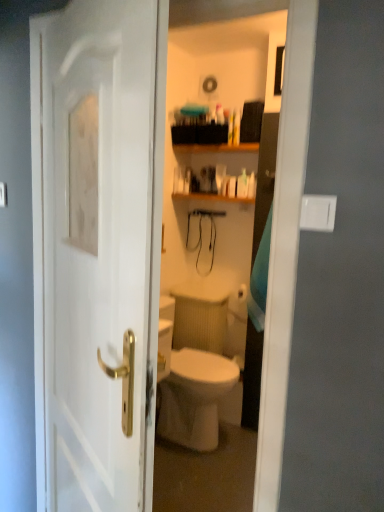
Question: From the image's perspective, does white glossy bottle at upper center appear higher than wooden shelf at upper center?

Choices:
 (A) no
 (B) yes

Answer: (A)

Question: Is white glossy bottle at upper center looking in the opposite direction of wooden shelf at upper center?

Choices:
 (A) yes
 (B) no

Answer: (B)

Question: Can you confirm if white glossy bottle at upper center is bigger than wooden shelf at upper center?

Choices:
 (A) no
 (B) yes

Answer: (A)

Question: Is the position of white glossy bottle at upper center less distant than that of wooden shelf at upper center?

Choices:
 (A) yes
 (B) no

Answer: (B)

Question: From the image's perspective, is white glossy bottle at upper center under wooden shelf at upper center?

Choices:
 (A) yes
 (B) no

Answer: (A)

Question: Is white glossy bottle at upper center wider or thinner than wooden shelf at upper center?

Choices:
 (A) wide
 (B) thin

Answer: (B)

Question: Which is correct: white glossy bottle at upper center is inside wooden shelf at upper center, or outside of it?

Choices:
 (A) outside
 (B) inside

Answer: (A)

Question: From a real-world perspective, is white glossy bottle at upper center physically located above or below wooden shelf at upper center?

Choices:
 (A) above
 (B) below

Answer: (B)

Question: Considering the positions of white glossy bottle at upper center and wooden shelf at upper center in the image, is white glossy bottle at upper center taller or shorter than wooden shelf at upper center?

Choices:
 (A) tall
 (B) short

Answer: (A)

Question: From their relative heights in the image, would you say wooden shelf at upper center is taller or shorter than white glossy bottle at upper center?

Choices:
 (A) tall
 (B) short

Answer: (B)

Question: Does point (241, 151) appear closer or farther from the camera than point (243, 181)?

Choices:
 (A) closer
 (B) farther

Answer: (A)

Question: Visually, is wooden shelf at upper center positioned to the left or to the right of white glossy bottle at upper center?

Choices:
 (A) left
 (B) right

Answer: (A)

Question: Considering their positions, is wooden shelf at upper center located in front of or behind white glossy bottle at upper center?

Choices:
 (A) behind
 (B) front

Answer: (B)

Question: Considering their positions, is white glossy door at center located in front of or behind wooden shelf at upper center?

Choices:
 (A) front
 (B) behind

Answer: (A)

Question: Is white glossy door at center wider or thinner than wooden shelf at upper center?

Choices:
 (A) thin
 (B) wide

Answer: (A)